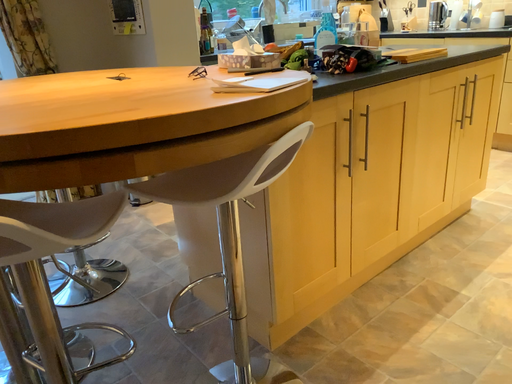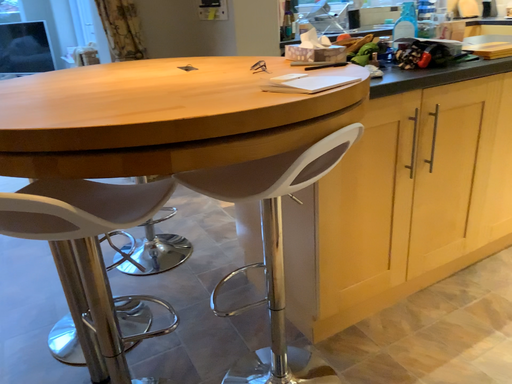
Question: How did the camera likely rotate when shooting the video?

Choices:
 (A) rotated left
 (B) rotated right

Answer: (A)